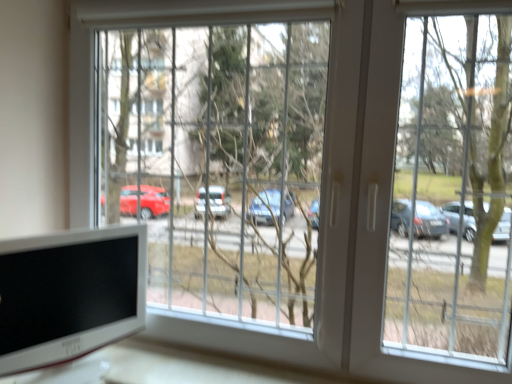
Identify the location of white glossy computer monitor at lower left. The image size is (512, 384). (69, 295).

The height and width of the screenshot is (384, 512). What do you see at coordinates (69, 295) in the screenshot?
I see `white glossy computer monitor at lower left` at bounding box center [69, 295].

Identify the location of white glossy computer monitor at lower left. This screenshot has height=384, width=512. (69, 295).